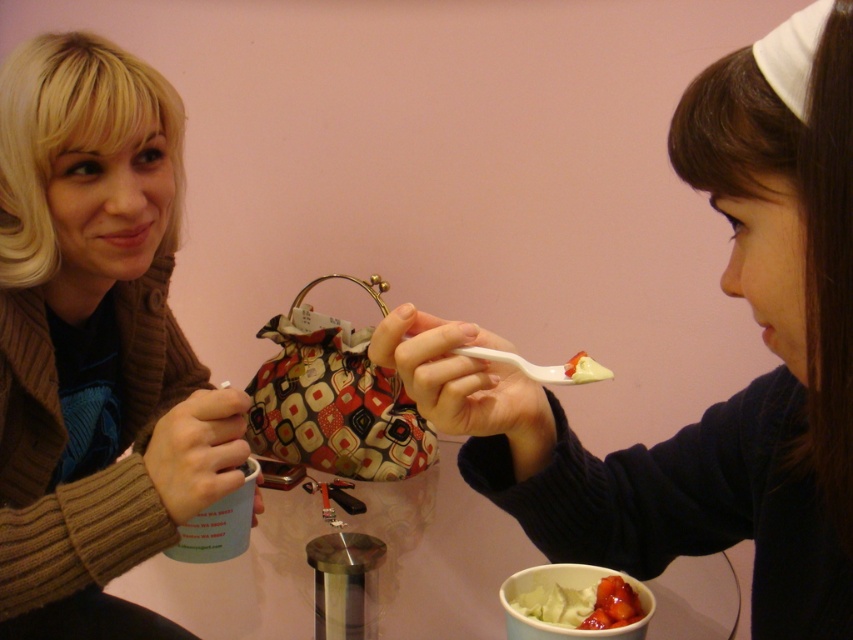
You are a food critic observing the scene. You notice the white matte spoon at upper center and the white creamy dessert at lower center. Based on their positions, which one is higher up?

The white matte spoon at upper center is above the white creamy dessert at lower center, so it is higher up.

You are a waiter at a cafe and need to deliver a dessert to the customer. The dessert is placed on the table between the white matte spoon at upper center and the matte brown sweater at left. Can you place the dessert in the center of the table without moving any existing items?

The white matte spoon at upper center is located below the matte brown sweater at left, so placing the dessert between them in the center of the table would require positioning it below the matte brown sweater at left and above the white matte spoon at upper center, ensuring it doesn not displace existing items.

You are sitting at the table between the two people. You want to place a small vase exactly halfway between the point at (16, 227) and the point at (619, 618). Will the vase be closer to the person on the left or the person on the right?

The point at (16, 227) is further to the viewer than the point at (619, 618). The halfway point between them would be closer to the person on the left because the first point is nearer to the viewer, so the distance between the two points is measured in 3D space, making the midpoint closer to the closer point.